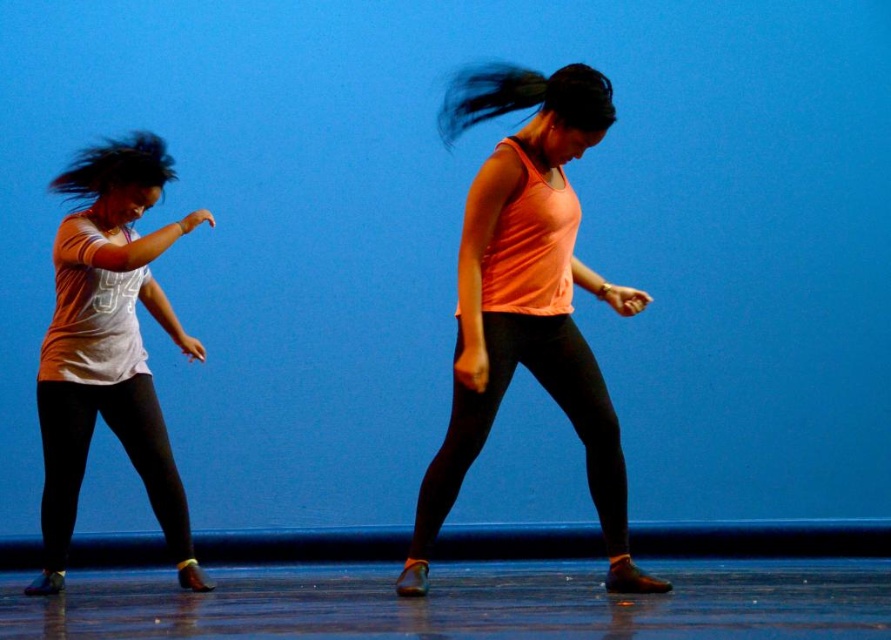
You are a photographer standing in front of the stage. You need to focus your camera on both the orange matte tank top at center and the black leggings at left. Which object should you focus on first to ensure both are in sharp focus?

You should focus on the orange matte tank top at center first because it is closer to the viewer than the black leggings at left. By focusing on the closer object, the depth of field may also keep the farther object in focus.

You are a photographer at the back of the stage. You want to capture a clear photo of the orange matte tank top at center and the black silky hair at center. Which object should you focus on first to ensure both are in focus?

The black silky hair at center is behind the orange matte tank top at center, so you should focus on the orange matte tank top at center first to ensure both are in focus.